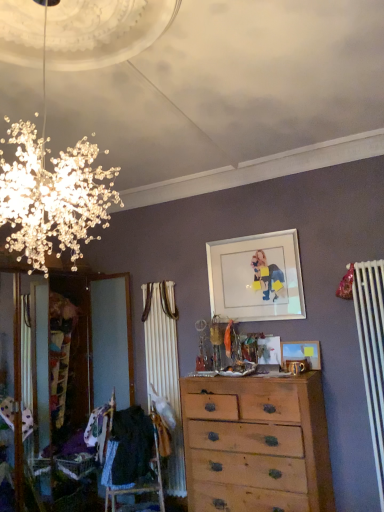
Question: Would you say wooden picture frame at center, the 1th picture frame ordered from the bottom, contains white glossy picture frame at upper center, the second picture frame in the bottom-to-top sequence?

Choices:
 (A) yes
 (B) no

Answer: (B)

Question: Can you confirm if wooden picture frame at center, the 1th picture frame ordered from the bottom, is smaller than white glossy picture frame at upper center, the second picture frame in the bottom-to-top sequence?

Choices:
 (A) no
 (B) yes

Answer: (B)

Question: Are wooden picture frame at center, the 2th picture frame viewed from the top, and white glossy picture frame at upper center, the second picture frame in the bottom-to-top sequence, beside each other?

Choices:
 (A) no
 (B) yes

Answer: (A)

Question: Is wooden picture frame at center, the 1th picture frame ordered from the bottom, wider than white glossy picture frame at upper center, the second picture frame in the bottom-to-top sequence?

Choices:
 (A) no
 (B) yes

Answer: (B)

Question: From the image's perspective, is wooden picture frame at center, the 1th picture frame ordered from the bottom, beneath white glossy picture frame at upper center, the second picture frame in the bottom-to-top sequence?

Choices:
 (A) yes
 (B) no

Answer: (A)

Question: Choose the correct answer: Is wooden picture frame at center, the 1th picture frame ordered from the bottom, inside black fabric at lower left or outside it?

Choices:
 (A) inside
 (B) outside

Answer: (B)

Question: Is wooden picture frame at center, the 2th picture frame viewed from the top, in front of or behind black fabric at lower left in the image?

Choices:
 (A) behind
 (B) front

Answer: (A)

Question: In terms of size, does wooden picture frame at center, the 1th picture frame ordered from the bottom, appear bigger or smaller than black fabric at lower left?

Choices:
 (A) small
 (B) big

Answer: (A)

Question: From a real-world perspective, relative to black fabric at lower left, is wooden picture frame at center, the 2th picture frame viewed from the top, vertically above or below?

Choices:
 (A) above
 (B) below

Answer: (A)

Question: From the image's perspective, is light brown wooden chest of drawers at center located above or below white glossy picture frame at upper center, the 1th picture frame from the top?

Choices:
 (A) below
 (B) above

Answer: (A)

Question: Is light brown wooden chest of drawers at center taller or shorter than white glossy picture frame at upper center, the 1th picture frame from the top?

Choices:
 (A) tall
 (B) short

Answer: (A)

Question: Would you say light brown wooden chest of drawers at center is to the left or to the right of white glossy picture frame at upper center, the 1th picture frame from the top, in the picture?

Choices:
 (A) right
 (B) left

Answer: (B)

Question: Considering the positions of point (327, 502) and point (216, 258), is point (327, 502) closer or farther from the camera than point (216, 258)?

Choices:
 (A) farther
 (B) closer

Answer: (B)

Question: Is wooden picture frame at center, the 1th picture frame ordered from the bottom, to the left or to the right of light brown wooden chest of drawers at center in the image?

Choices:
 (A) right
 (B) left

Answer: (A)

Question: In terms of width, does wooden picture frame at center, the 2th picture frame viewed from the top, look wider or thinner when compared to light brown wooden chest of drawers at center?

Choices:
 (A) wide
 (B) thin

Answer: (B)